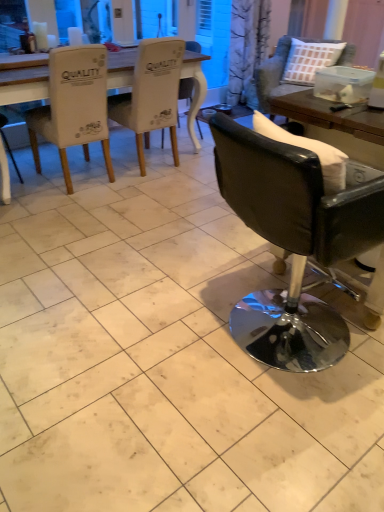
At what (x,y) coordinates should I click in order to perform the action: click on free location in front of black leather chair at right, acting as the 2th chair starting from the right. Please return your answer as a coordinate pair (x, y). Looking at the image, I should click on (271, 434).